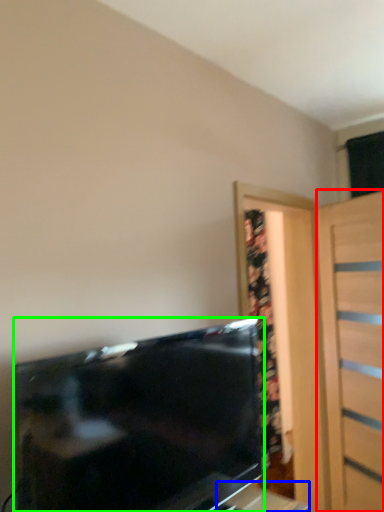
Question: Which object is positioned closest to door (highlighted by a red box)? Select from table (highlighted by a blue box) and television (highlighted by a green box).

Choices:
 (A) table
 (B) television

Answer: (A)